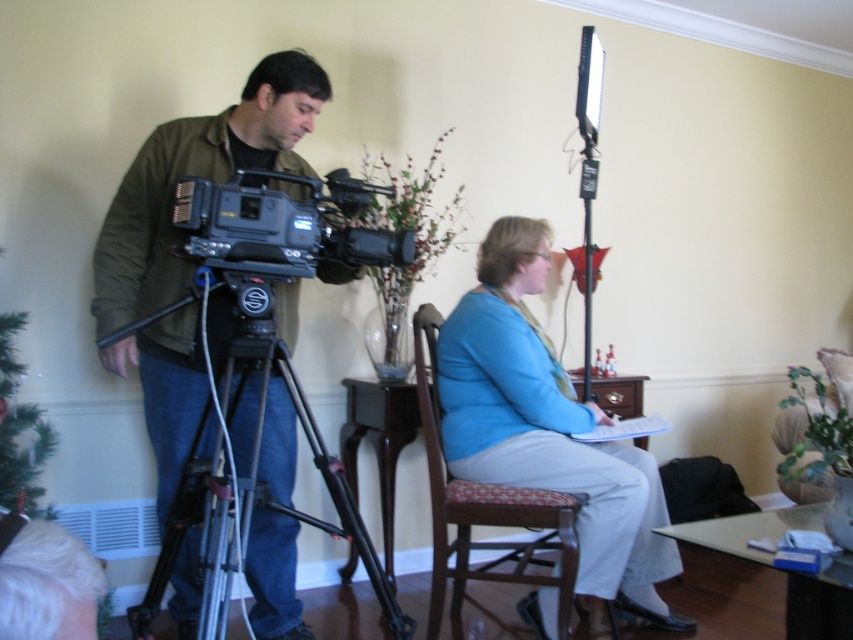
Question: Does matte black camera at left have a smaller size compared to blue fabric shirt at center?

Choices:
 (A) yes
 (B) no

Answer: (A)

Question: Which point is farther to the camera?

Choices:
 (A) (196, 621)
 (B) (251, 234)
 (C) (503, 376)
 (D) (265, 518)

Answer: (C)

Question: Which object is positioned farthest from the silver metallic tripod at left?

Choices:
 (A) matte black camera at left
 (B) woodenchair at center
 (C) blue fabric shirt at center

Answer: (C)

Question: Among these points, which one is farthest from the camera?

Choices:
 (A) (451, 426)
 (B) (471, 502)
 (C) (288, 163)

Answer: (A)

Question: Can you confirm if blue fabric shirt at center is positioned above woodenchair at center?

Choices:
 (A) no
 (B) yes

Answer: (B)

Question: Is blue fabric shirt at center in front of black plastic video camera at left?

Choices:
 (A) no
 (B) yes

Answer: (A)